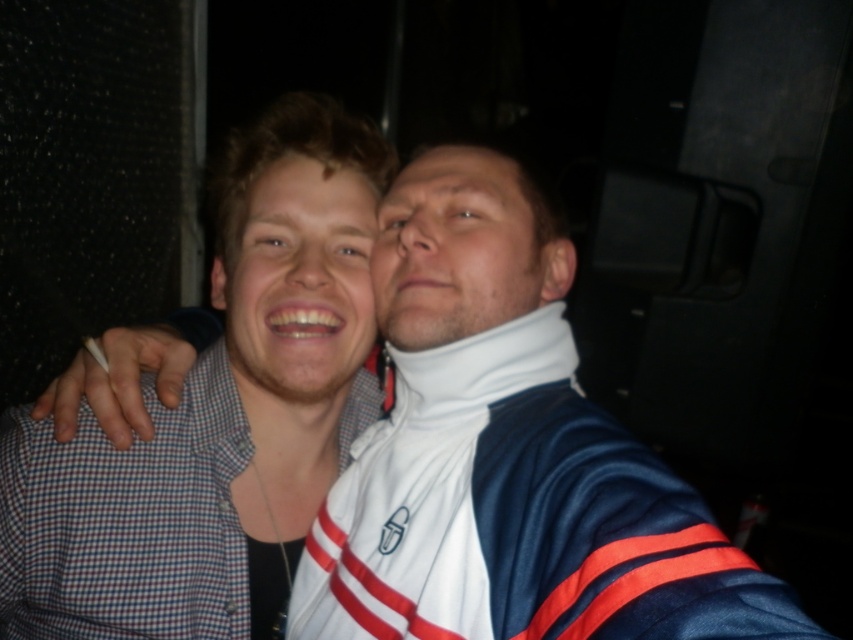
Question: Which of the following is the closest to the observer?

Choices:
 (A) (282, 372)
 (B) (256, 252)
 (C) (438, 301)

Answer: (C)

Question: Observing the image, what is the correct spatial positioning of checkered fabric shirt at left in reference to white matte neck brace at center?

Choices:
 (A) above
 (B) below

Answer: (B)

Question: Can you confirm if checkered fabric shirt at left is bigger than matte skin face at center?

Choices:
 (A) yes
 (B) no

Answer: (A)

Question: Among these objects, which one is nearest to the camera?

Choices:
 (A) white matte neck brace at center
 (B) matte skin face at center

Answer: (A)

Question: Is checkered fabric shirt at left further to the viewer compared to white matte neck brace at center?

Choices:
 (A) yes
 (B) no

Answer: (A)

Question: Which object appears closest to the camera in this image?

Choices:
 (A) checkered fabric shirt at left
 (B) matte skin face at center
 (C) white matte neck brace at center

Answer: (C)